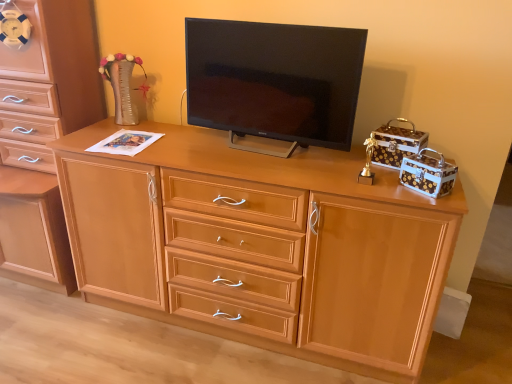
Find the location of a particular element. The image size is (512, 384). free region on the left part of matte black tv at center is located at coordinates (185, 146).